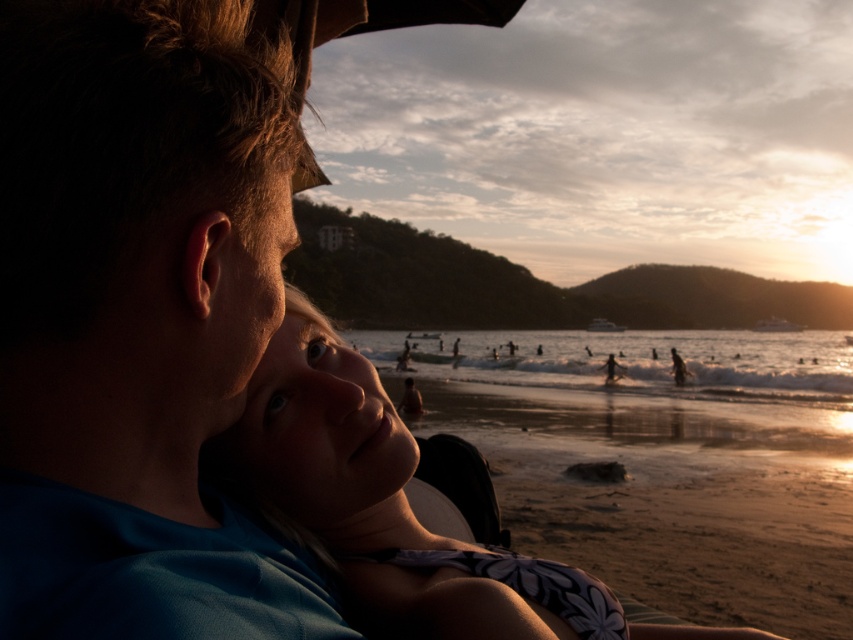
Which of these two, blue fabric shirt at center or smooth skin face at center, stands shorter?

blue fabric shirt at center is shorter.

The image size is (853, 640). What do you see at coordinates (138, 320) in the screenshot? I see `blue fabric shirt at center` at bounding box center [138, 320].

Is point (131, 417) closer to viewer compared to point (281, 332)?

Yes.

Locate an element on the screen. This screenshot has height=640, width=853. blue fabric shirt at center is located at coordinates (138, 320).